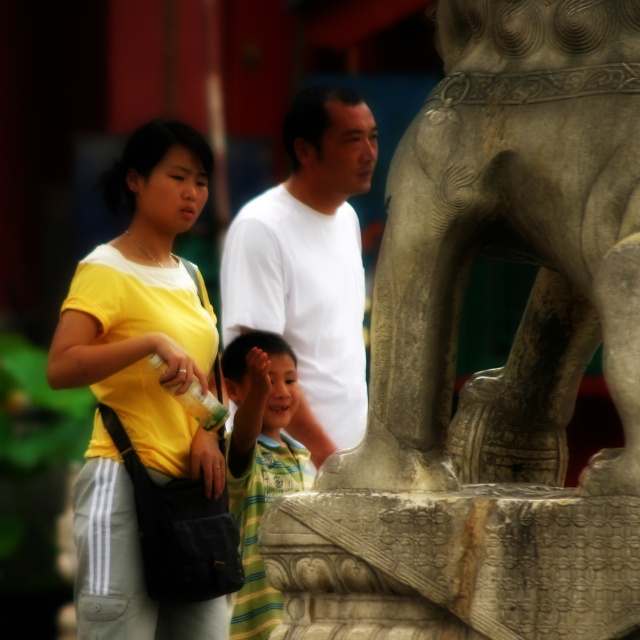
Consider the image. Is yellow matte shirt at center behind striped cotton shirt at center?

No, yellow matte shirt at center is closer to the viewer.

Between point (72, 324) and point (228, 385), which one is positioned in front?

Positioned in front is point (72, 324).

Is point (138, 561) closer to viewer compared to point (256, 616)?

That is True.

Image resolution: width=640 pixels, height=640 pixels. I want to click on yellow matte shirt at center, so click(147, 307).

What do you see at coordinates (493, 369) in the screenshot? I see `gray stone statue at right` at bounding box center [493, 369].

Does gray stone statue at right appear over white matte shirt at center?

Actually, gray stone statue at right is below white matte shirt at center.

Describe the element at coordinates (493, 369) in the screenshot. I see `gray stone statue at right` at that location.

The width and height of the screenshot is (640, 640). Identify the location of gray stone statue at right. (493, 369).

In the scene shown: Who is positioned more to the left, gray stone statue at right or striped cotton shirt at center?

From the viewer's perspective, striped cotton shirt at center appears more on the left side.

Looking at this image, measure the distance from gray stone statue at right to striped cotton shirt at center.

They are 121.63 feet apart.

The width and height of the screenshot is (640, 640). Identify the location of gray stone statue at right. (493, 369).